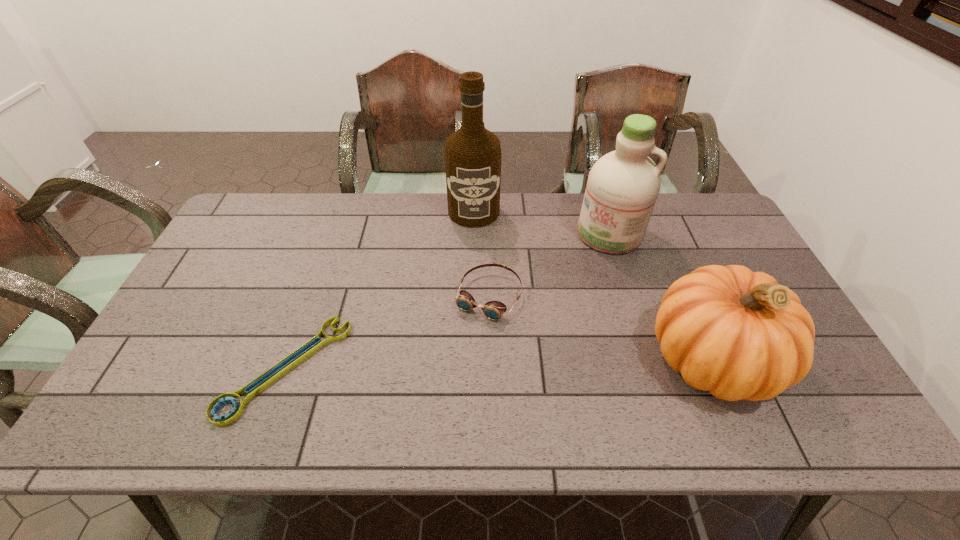
The image size is (960, 540). Identify the location of vacant space located through the lenses of the goggles. (467, 339).

This screenshot has width=960, height=540. I want to click on free space located on the label of the alcohol, so tap(475, 262).

Locate an element on the screen. The height and width of the screenshot is (540, 960). vacant region located 0.220m on the label of the alcohol is located at coordinates (475, 276).

Image resolution: width=960 pixels, height=540 pixels. Find the location of `free space located on the label of the alcohol`. free space located on the label of the alcohol is located at coordinates (476, 288).

This screenshot has height=540, width=960. I want to click on vacant area situated 0.120m on the front label of the cleansing agent, so click(x=582, y=276).

I want to click on vacant region located on the front label of the cleansing agent, so click(569, 295).

Find the location of a particular element. free region located on the front label of the cleansing agent is located at coordinates (x=577, y=285).

Identify the location of alcohol at the far edge. (473, 155).

I want to click on cleansing agent that is at the far edge, so click(x=622, y=188).

Where is `wrench present at the near edge`? wrench present at the near edge is located at coordinates (261, 382).